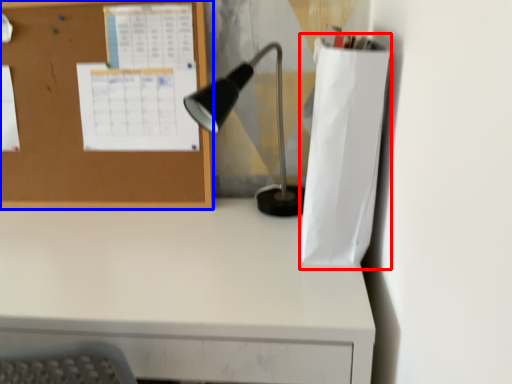
Question: Among these objects, which one is farthest to the camera, paper bag (highlighted by a red box) or bulletin board (highlighted by a blue box)?

Choices:
 (A) paper bag
 (B) bulletin board

Answer: (B)